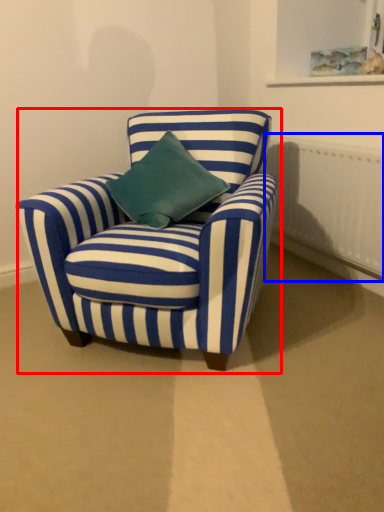
Question: Which object appears closest to the camera in this image, chair (highlighted by a red box) or radiator (highlighted by a blue box)?

Choices:
 (A) chair
 (B) radiator

Answer: (A)